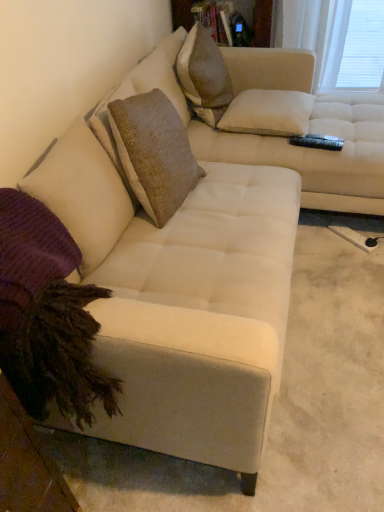
Question: From the image's perspective, is purple knitted pillow at lower left, arranged as the 2th pillow when viewed from the right, over white matte window screen at upper right?

Choices:
 (A) yes
 (B) no

Answer: (B)

Question: Are purple knitted pillow at lower left, which is the first pillow from bottom to top, and white matte window screen at upper right located far from each other?

Choices:
 (A) yes
 (B) no

Answer: (A)

Question: Considering the relative sizes of purple knitted pillow at lower left, the second pillow from the top, and white matte window screen at upper right in the image provided, is purple knitted pillow at lower left, the second pillow from the top, wider than white matte window screen at upper right?

Choices:
 (A) yes
 (B) no

Answer: (A)

Question: Is purple knitted pillow at lower left, which is the first pillow in front-to-back order, shorter than white matte window screen at upper right?

Choices:
 (A) yes
 (B) no

Answer: (A)

Question: Is purple knitted pillow at lower left, arranged as the 2th pillow when viewed from the right, oriented away from white matte window screen at upper right?

Choices:
 (A) yes
 (B) no

Answer: (B)

Question: From a real-world perspective, is white matte window screen at upper right physically located above or below white textured pillow at upper center, placed as the first pillow when sorted from right to left?

Choices:
 (A) above
 (B) below

Answer: (B)

Question: From the image's perspective, is white matte window screen at upper right located above or below white textured pillow at upper center, acting as the second pillow starting from the front?

Choices:
 (A) below
 (B) above

Answer: (B)

Question: Considering the positions of point (362, 15) and point (291, 105), is point (362, 15) closer or farther from the camera than point (291, 105)?

Choices:
 (A) farther
 (B) closer

Answer: (A)

Question: In terms of size, does white matte window screen at upper right appear bigger or smaller than white textured pillow at upper center, marked as the first pillow in a top-to-bottom arrangement?

Choices:
 (A) big
 (B) small

Answer: (A)

Question: Looking at their shapes, would you say white matte window screen at upper right is wider or thinner than purple knitted pillow at lower left, which is the first pillow in front-to-back order?

Choices:
 (A) wide
 (B) thin

Answer: (B)

Question: In the image, is white matte window screen at upper right on the left side or the right side of purple knitted pillow at lower left, arranged as the 2th pillow when viewed from the right?

Choices:
 (A) left
 (B) right

Answer: (B)

Question: Choose the correct answer: Is white matte window screen at upper right inside purple knitted pillow at lower left, marked as the first pillow in a left-to-right arrangement, or outside it?

Choices:
 (A) outside
 (B) inside

Answer: (A)

Question: In the image, is white matte window screen at upper right positioned in front of or behind purple knitted pillow at lower left, which is the first pillow in front-to-back order?

Choices:
 (A) front
 (B) behind

Answer: (B)

Question: Considering the positions of point (264, 119) and point (215, 87), is point (264, 119) closer or farther from the camera than point (215, 87)?

Choices:
 (A) closer
 (B) farther

Answer: (A)

Question: Relative to textured beige pillow at upper center, is white textured pillow at upper center, acting as the second pillow starting from the front, in front or behind?

Choices:
 (A) behind
 (B) front

Answer: (A)